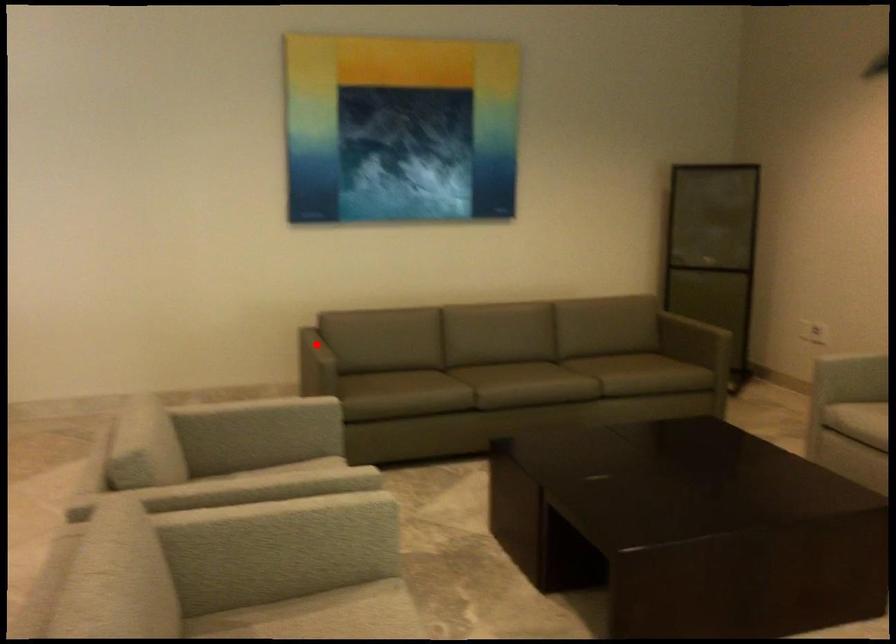
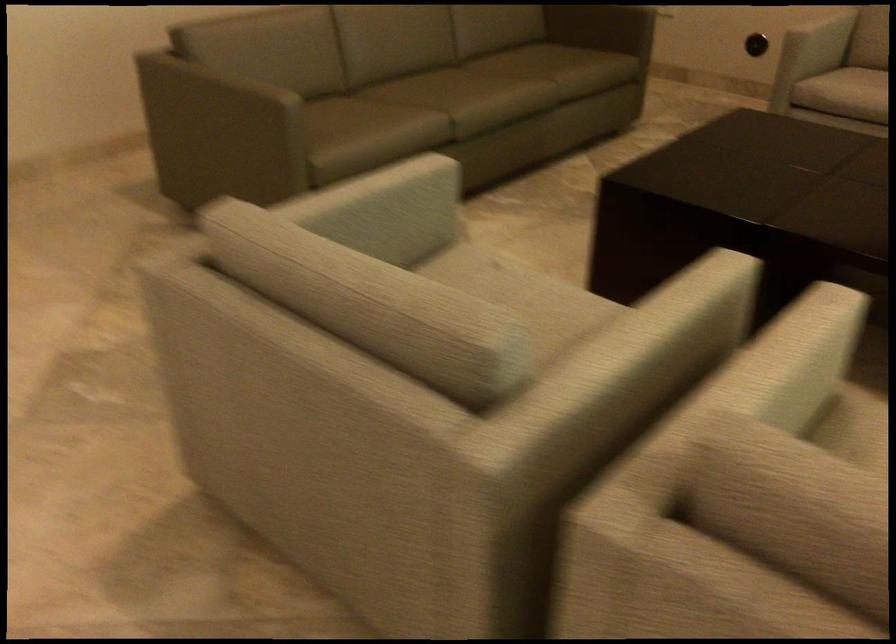
In the second image, find the point that corresponds to the highlighted location in the first image.

(231, 80)